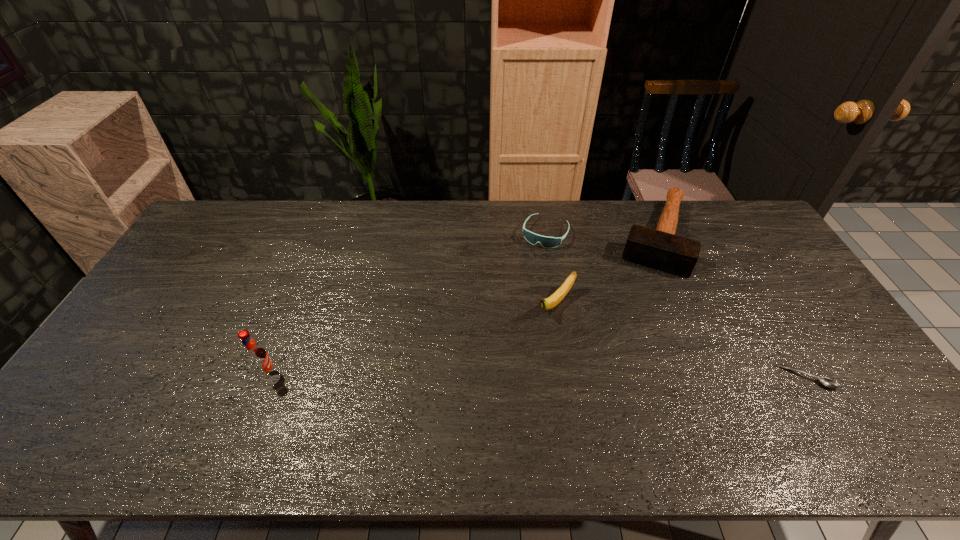
This screenshot has height=540, width=960. Identify the location of root beer. (256, 356).

Identify the location of the tallest object. (256, 356).

Where is `the rightmost object`? This screenshot has width=960, height=540. the rightmost object is located at coordinates (827, 382).

The width and height of the screenshot is (960, 540). I want to click on soupspoon, so click(x=827, y=382).

Where is `goggles`? goggles is located at coordinates (547, 242).

Identify the location of the third farthest object. (549, 303).

Where is `mallet`? mallet is located at coordinates (661, 249).

Identify the location of vacant space located on the right of the tallest object. (372, 375).

Identify the location of vacant space located on the back of the rightmost object. The width and height of the screenshot is (960, 540). (745, 274).

Where is `vacant region located on the front-facing side of the goggles`? The height and width of the screenshot is (540, 960). vacant region located on the front-facing side of the goggles is located at coordinates tap(495, 332).